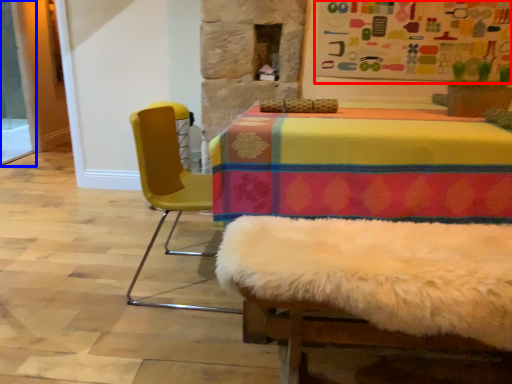
Question: Which object appears farthest to the camera in this image, bulletin board (highlighted by a red box) or screen door (highlighted by a blue box)?

Choices:
 (A) bulletin board
 (B) screen door

Answer: (B)